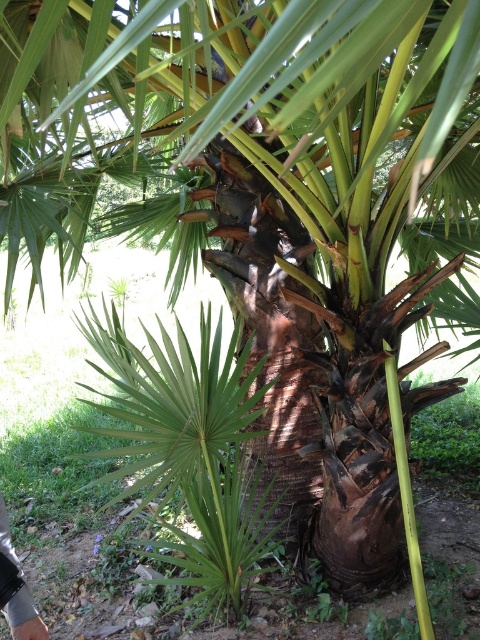
You are an artist observing the palm tree and notice two objects at the lower left corner of your view. Which object is located more to the left between the metallic silver glove at lower left and the gray fabric hand at lower left?

The metallic silver glove at lower left is positioned on the left side of gray fabric hand at lower left, so the metallic silver glove at lower left is more to the left.

You are standing in front of a palm tree and notice a metallic silver glove at lower left. Where exactly is the metallic silver glove positioned relative to the palm tree?

The metallic silver glove at lower left is located at point coordinates approximately 0.927 along the horizontal axis and 0.040 along the vertical axis relative to the palm tree.